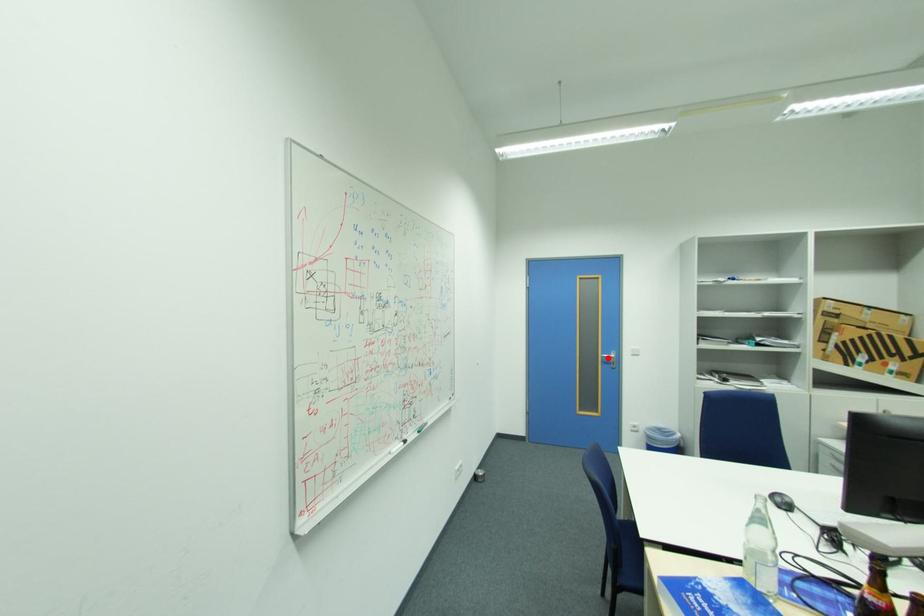
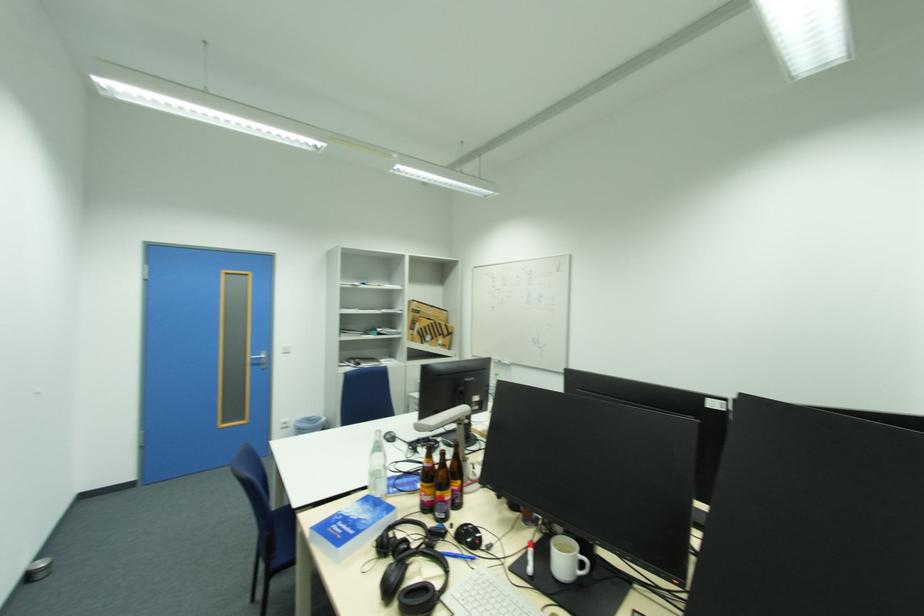
Question: I am providing you with two images of the same scene from different viewpoints. A red point is marked on the first image. At the location where the point appears in image 1, is it still visible in image 2?

Choices:
 (A) Yes
 (B) No

Answer: (A)